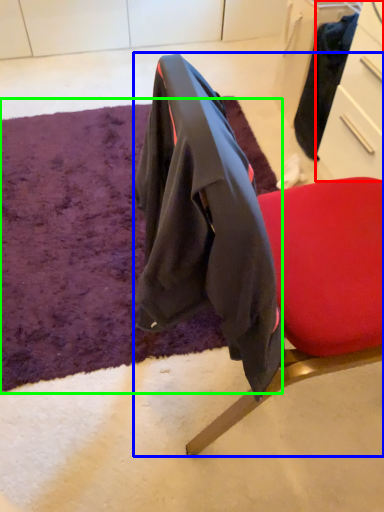
Question: Based on their relative distances, which object is nearer to drawer (highlighted by a red box)? Choose from chair (highlighted by a blue box) and mat (highlighted by a green box).

Choices:
 (A) chair
 (B) mat

Answer: (A)